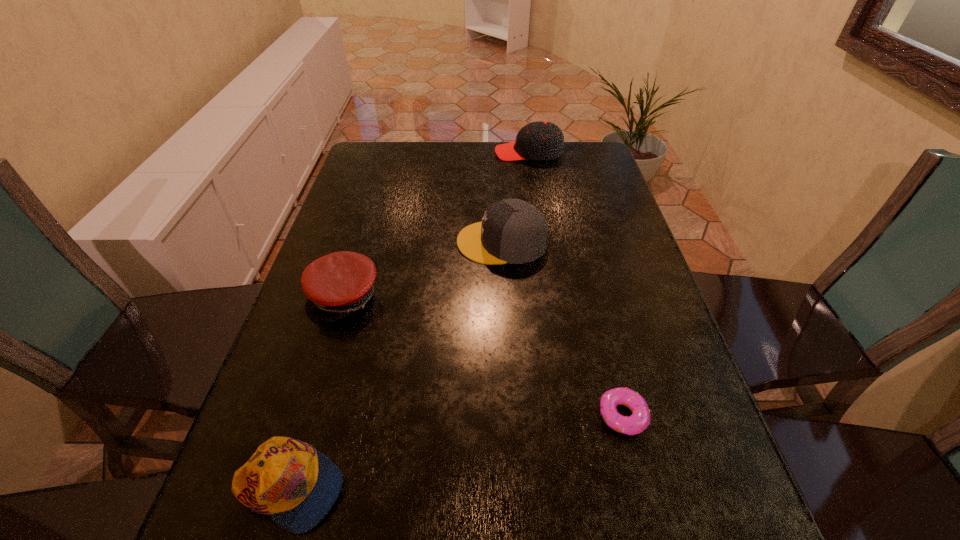
Image resolution: width=960 pixels, height=540 pixels. Find the location of `free spot at the right edge of the desktop`. free spot at the right edge of the desktop is located at coordinates (697, 463).

In the image, there is a desktop. In order to click on vacant space at the far left corner in this screenshot , I will do `click(359, 173)`.

What are the coordinates of `free space that is in between the doughnut and the farthest cap` in the screenshot? It's located at (576, 284).

Identify the location of free space between the third farthest object and the nearest object. Image resolution: width=960 pixels, height=540 pixels. (317, 392).

Find the location of `free spot between the third farthest cap and the farthest cap`. free spot between the third farthest cap and the farthest cap is located at coordinates (437, 225).

Identify the location of vacant area between the third nearest cap and the shortest object. (563, 328).

Find the location of a particular element. vacant region between the fourth nearest object and the farthest object is located at coordinates (515, 197).

Where is `blank region between the second nearest cap and the second farthest object`? The width and height of the screenshot is (960, 540). blank region between the second nearest cap and the second farthest object is located at coordinates (423, 269).

This screenshot has height=540, width=960. I want to click on vacant area that lies between the second farthest object and the farthest cap, so click(x=515, y=197).

The image size is (960, 540). Identify the location of free space between the farthest object and the nearest object. (409, 320).